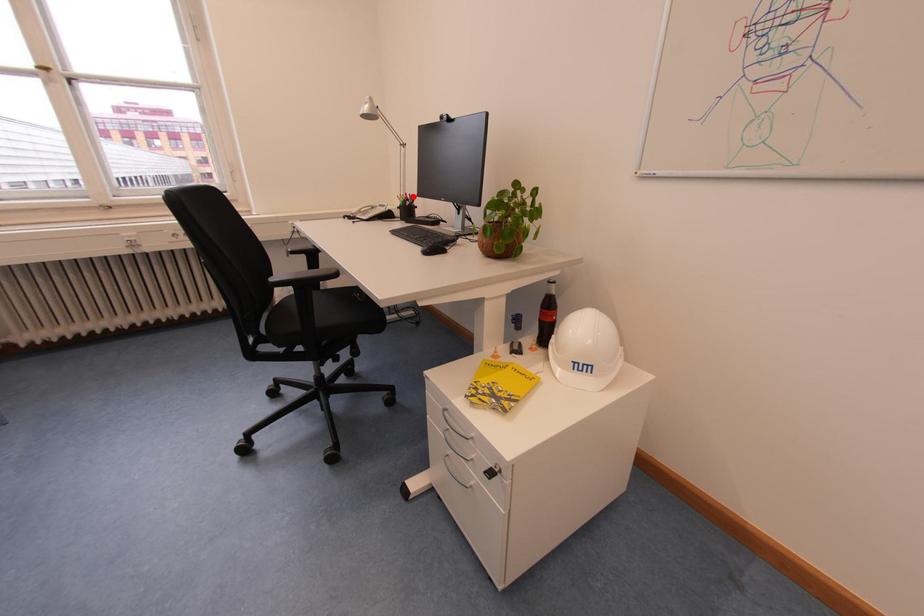
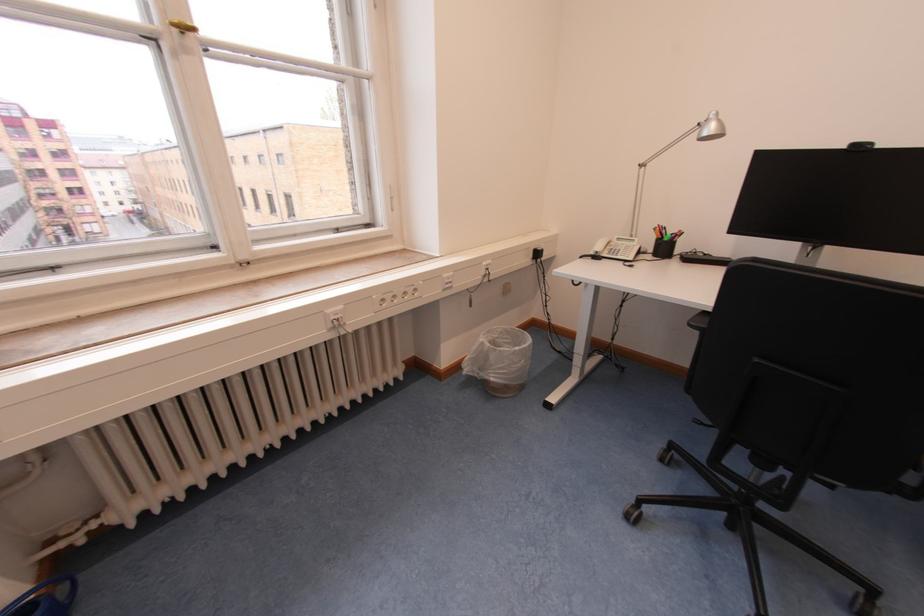
Find the pixel in the second image that matches the highlighted location in the first image.

(665, 228)